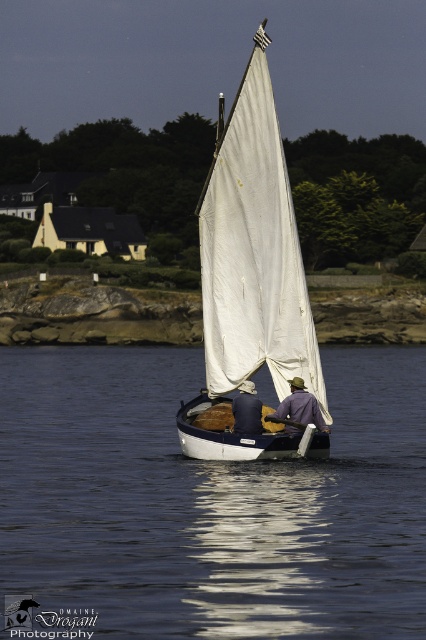
You are on a boat and see the transparent blue water at center and the purple fabric at center. Which object is positioned to the right side?

The purple fabric at center is positioned to the right of the transparent blue water at center.

You are planning to store the white sailboat at center and the denim jacket at center in a storage unit. The storage unit has a width limit of 1 meter. Based on the scene, can both items fit side by side within the storage unit?

The white sailboat at center is wider than the denim jacket at center. Since the storage unit has a width limit of 1 meter, we need to know the combined width of both items. However, the exact widths aren not provided. Therefore, it is uncertain if they can fit side by side.

You are planning to take a short trip on the water and need to know if the white sailboat at center can accommodate both the denim jacket at center and additional gear. Based on the scene description, can you determine if there is enough space?

The white sailboat at center is larger in size compared to the denim jacket at center, so there is likely enough space to accommodate both the denim jacket at center and additional gear.